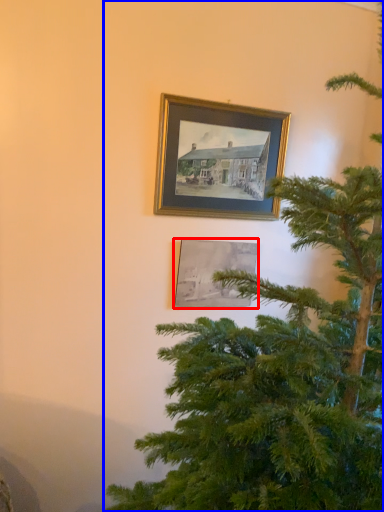
Question: Among these objects, which one is farthest to the camera, picture frame (highlighted by a red box) or christmas tree (highlighted by a blue box)?

Choices:
 (A) picture frame
 (B) christmas tree

Answer: (A)